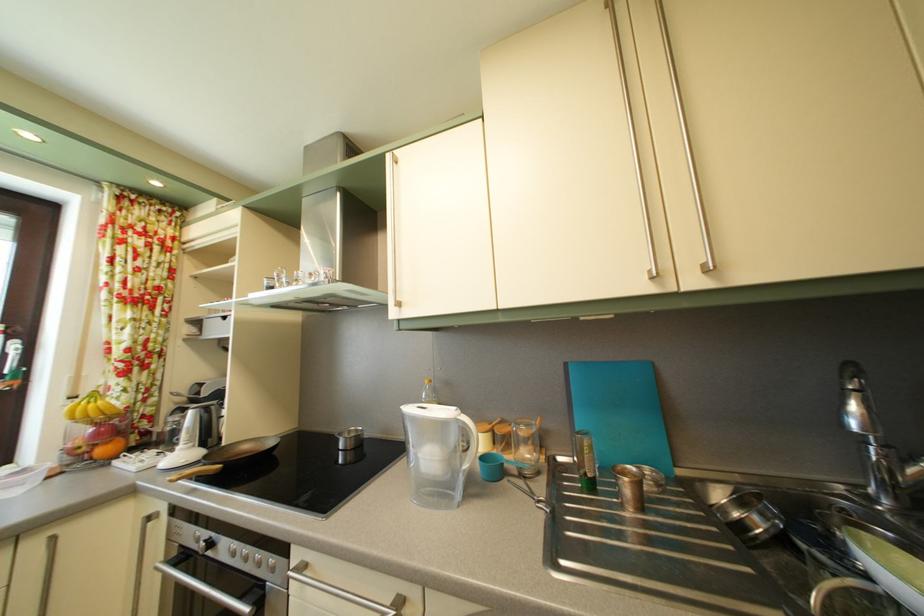
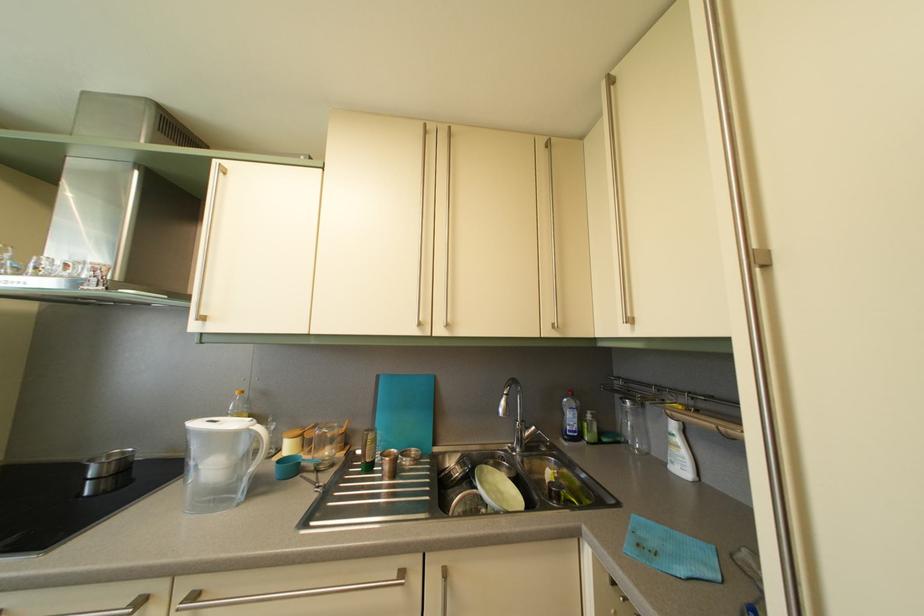
Where in the second image is the point corresponding to the point at 893,454 from the first image?

(530, 429)